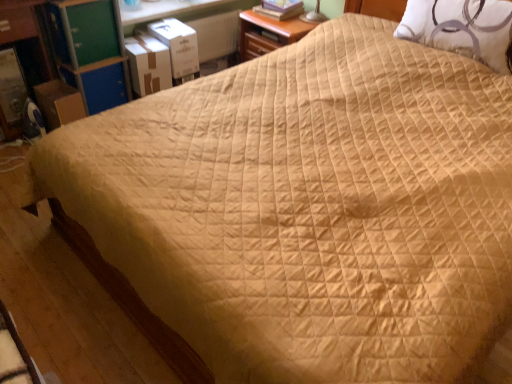
Question: Do you think white cardboard box at upper left, which ranks as the second cardboard box in left-to-right order, is within brown cardboard box at left, marked as the 1th cardboard box in a left-to-right arrangement, or outside of it?

Choices:
 (A) outside
 (B) inside

Answer: (A)

Question: From a real-world perspective, is white cardboard box at upper left, acting as the 2th cardboard box starting from the right, physically located above or below brown cardboard box at left, the third cardboard box when ordered from right to left?

Choices:
 (A) below
 (B) above

Answer: (B)

Question: Based on their relative distances, which object is nearer to the white cardboard box at upper left, the first cardboard box in the right-to-left sequence?

Choices:
 (A) white quilted pillow at upper right
 (B) white cardboard box at upper left, which ranks as the second cardboard box in left-to-right order
 (C) green plastic dresser at upper left, placed as the second dresser when sorted from left to right
 (D) brown wood dresser at left, which is the first dresser in left-to-right order
 (E) wooden nightstand at upper center

Answer: (B)

Question: Which of these objects is positioned closest to the hardcover book at upper center?

Choices:
 (A) brown cardboard box at left, the third cardboard box when ordered from right to left
 (B) brown wood dresser at left, which is the 2th dresser from right to left
 (C) wooden nightstand at upper center
 (D) green plastic dresser at upper left, which is the first dresser in right-to-left order
 (E) white quilted pillow at upper right

Answer: (C)